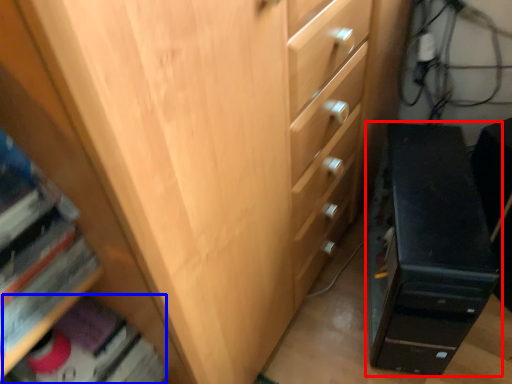
Question: Which point is closer to the camera, chest of drawers (highlighted by a red box) or book (highlighted by a blue box)?

Choices:
 (A) chest of drawers
 (B) book

Answer: (B)